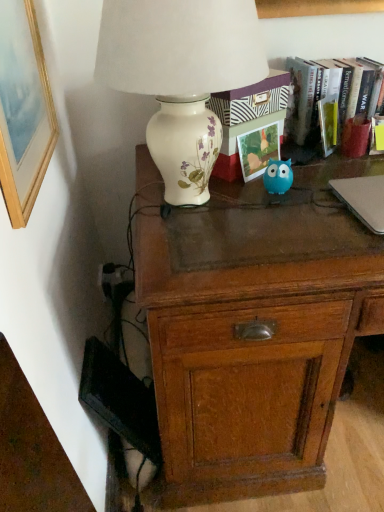
Where is `blank area beneath porcelain floral lamp at upper left (from a real-world perspective)`? The height and width of the screenshot is (512, 384). blank area beneath porcelain floral lamp at upper left (from a real-world perspective) is located at coordinates (189, 207).